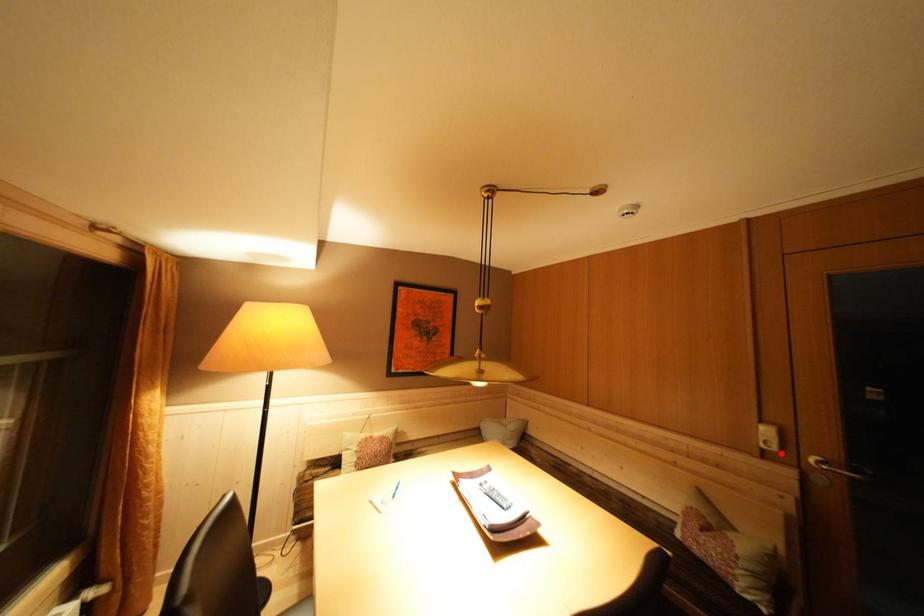
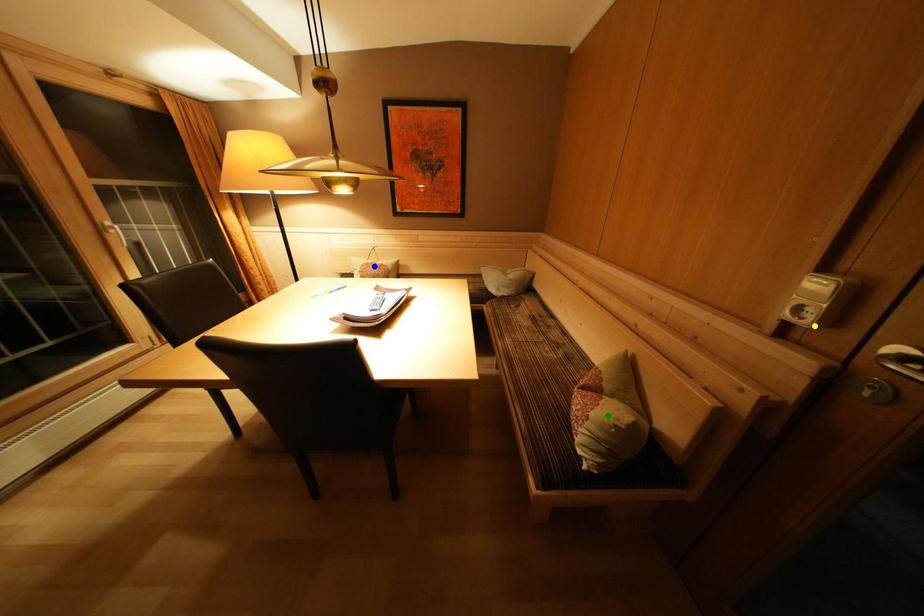
Question: I am providing you with two images of the same scene from different viewpoints. A red point is marked on the first image. You are given multiple points on the second image. Which spot in image 2 lines up with the point in image 1?

Choices:
 (A) yellow point
 (B) blue point
 (C) green point

Answer: (A)